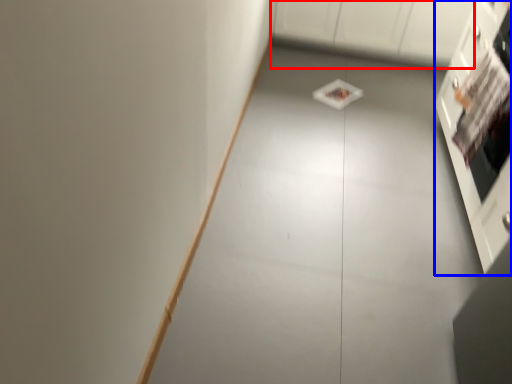
Question: Among these objects, which one is nearest to the camera, cabinetry (highlighted by a red box) or cabinetry (highlighted by a blue box)?

Choices:
 (A) cabinetry
 (B) cabinetry

Answer: (B)